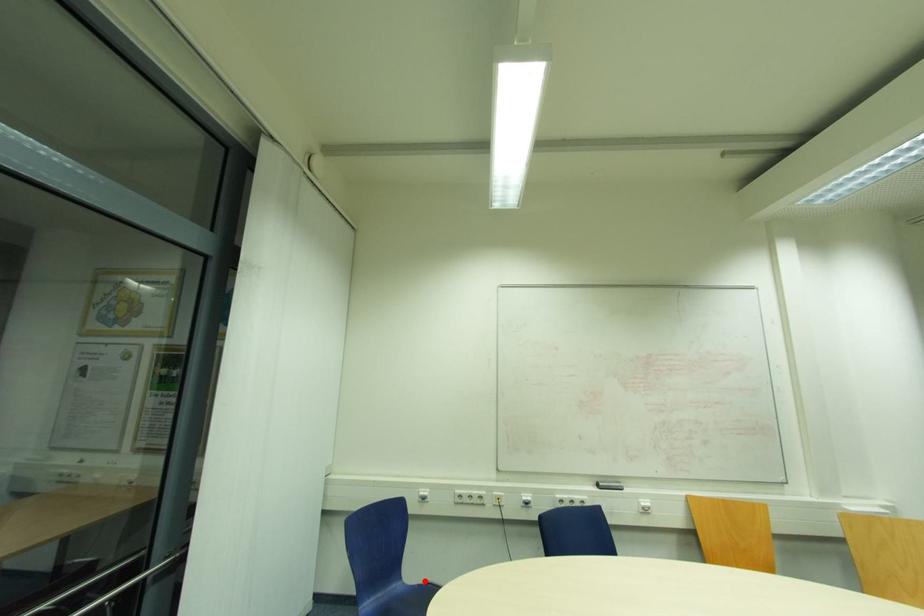
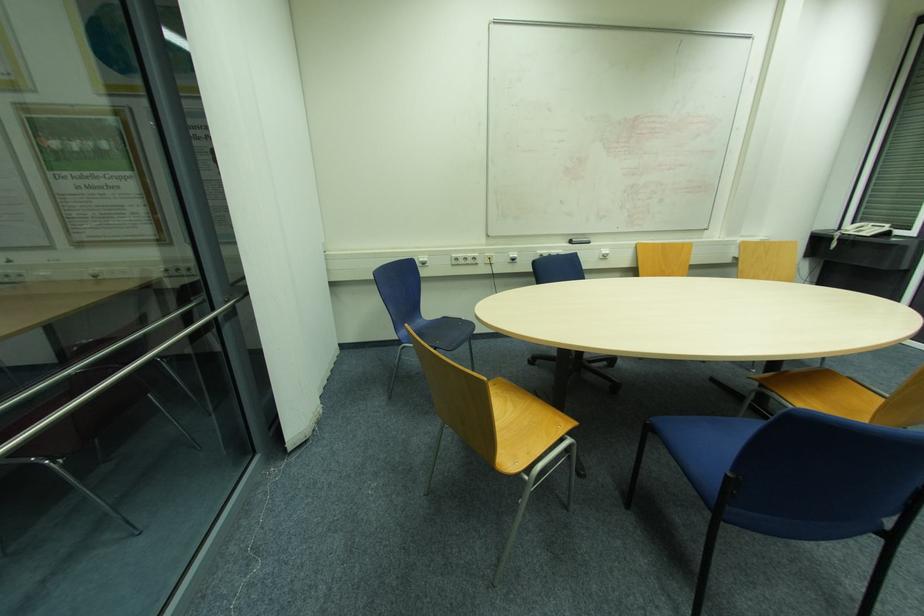
Question: I am providing you with two images of the same scene from different viewpoints. A red point is marked on the first image. At the location where the point appears in image 1, is it still visible in image 2?

Choices:
 (A) Yes
 (B) No

Answer: (A)